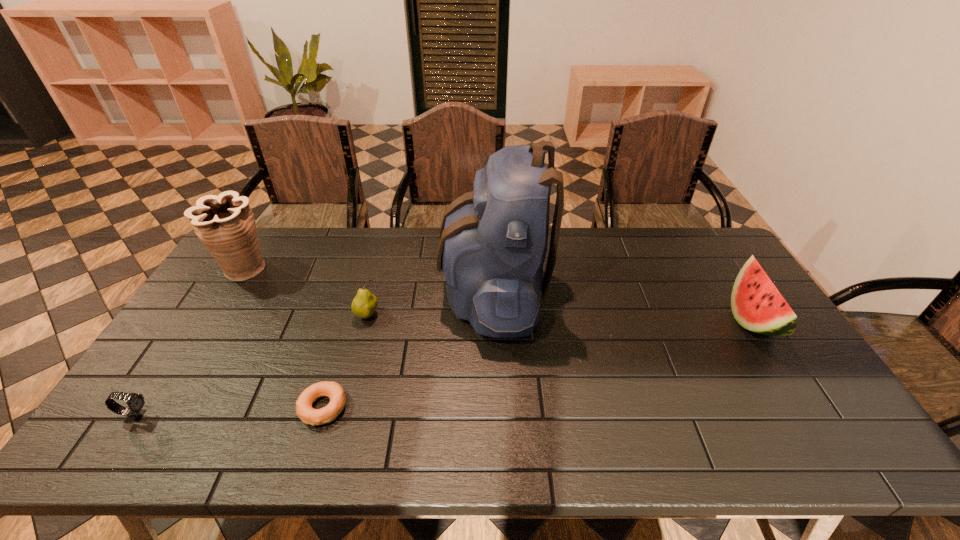
At what (x,y) coordinates should I click in order to perform the action: click on watch at the near edge. Please return your answer as a coordinate pair (x, y). Looking at the image, I should click on (135, 402).

Find the location of a particular element. This screenshot has height=540, width=960. bagel located at the near edge is located at coordinates (333, 390).

The image size is (960, 540). In order to click on urn at the left edge in this screenshot , I will do `click(225, 224)`.

Where is `watch present at the left edge`? This screenshot has height=540, width=960. watch present at the left edge is located at coordinates (135, 402).

The image size is (960, 540). In order to click on object at the right edge in this screenshot , I will do `click(757, 305)`.

Where is `object that is at the far left corner`? This screenshot has height=540, width=960. object that is at the far left corner is located at coordinates (225, 224).

Locate an element on the screen. object that is at the near left corner is located at coordinates (135, 402).

Where is `free region at the far edge`? The width and height of the screenshot is (960, 540). free region at the far edge is located at coordinates (591, 229).

Locate an element on the screen. The height and width of the screenshot is (540, 960). vacant space at the near edge of the desktop is located at coordinates (388, 458).

Locate an element on the screen. The width and height of the screenshot is (960, 540). vacant space at the left edge of the desktop is located at coordinates (179, 360).